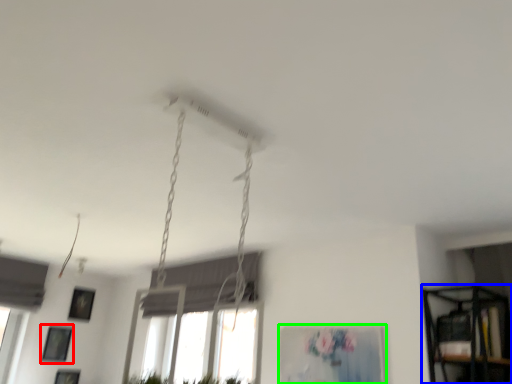
Question: Based on their relative distances, which object is farther from picture frame (highlighted by a red box)? Choose from shelf (highlighted by a blue box) and picture frame (highlighted by a green box).

Choices:
 (A) shelf
 (B) picture frame

Answer: (A)